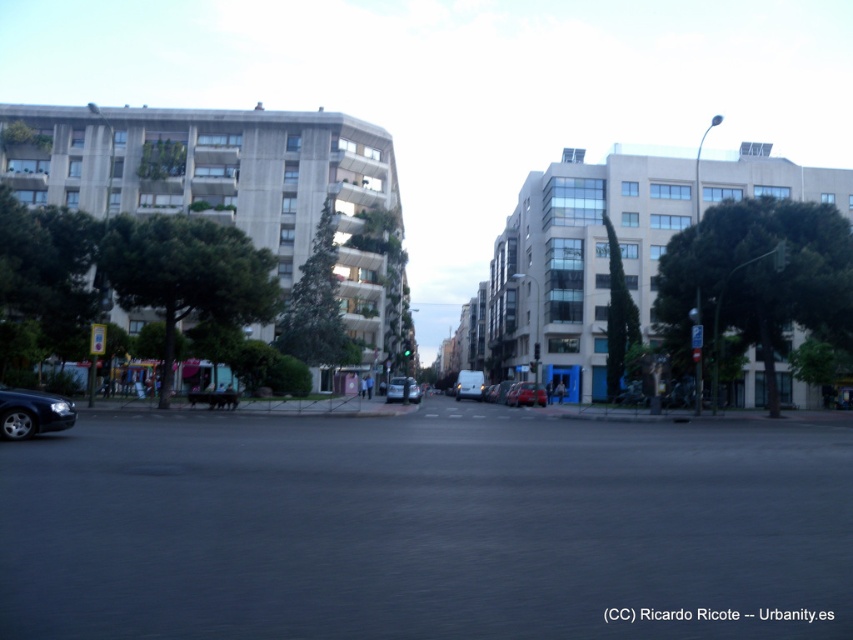
Does shiny black sedan at lower left appear under shiny red car at center?

Incorrect, shiny black sedan at lower left is not positioned below shiny red car at center.

Consider the image. Who is positioned more to the right, shiny black sedan at lower left or shiny red car at center?

Positioned to the right is shiny red car at center.

Measure the distance between point (61, 413) and camera.

15.17 meters

Image resolution: width=853 pixels, height=640 pixels. Identify the location of shiny black sedan at lower left. (32, 412).

Measure the distance from shiny black sedan at lower left to silver metallic van at center.

shiny black sedan at lower left and silver metallic van at center are 40.81 meters apart.

Image resolution: width=853 pixels, height=640 pixels. Identify the location of shiny black sedan at lower left. 32,412.

This screenshot has width=853, height=640. I want to click on shiny black sedan at lower left, so coord(32,412).

Can you confirm if shiny red car at center is smaller than silver metallic van at center?

Correct, shiny red car at center occupies less space than silver metallic van at center.

Can you confirm if shiny red car at center is positioned to the left of silver metallic van at center?

Incorrect, shiny red car at center is not on the left side of silver metallic van at center.

Which is behind, point (521, 381) or point (397, 376)?

The point (397, 376) is more distant.

This screenshot has height=640, width=853. What are the coordinates of `shiny red car at center` in the screenshot? It's located at (525, 394).